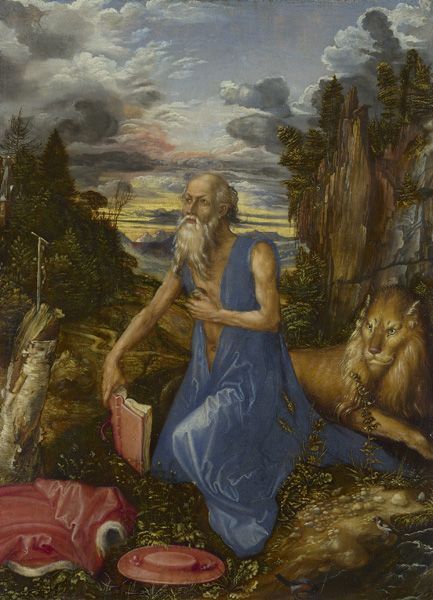
Image resolution: width=433 pixels, height=600 pixels. Identify the location of wooden trunk. (39, 327), (21, 388), (20, 444).